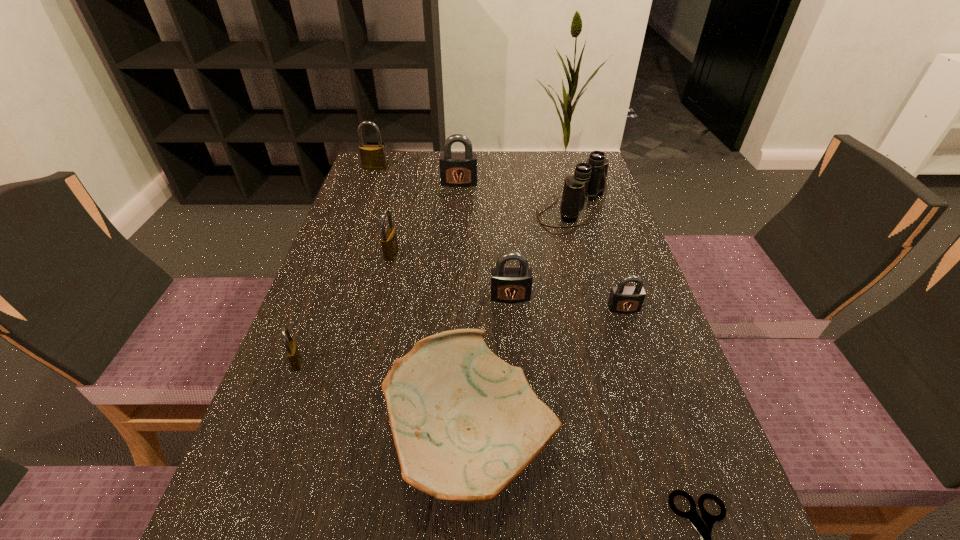
The width and height of the screenshot is (960, 540). In order to click on the nearest padlock in this screenshot , I will do `click(292, 351)`.

Image resolution: width=960 pixels, height=540 pixels. I want to click on the nearest brass padlock, so click(292, 351).

You are a GUI agent. You are given a task and a screenshot of the screen. Output one action in this format:
    pyautogui.click(x=<x>, y=<y>)
    Task: Click on the rightmost gray padlock
    Image resolution: width=960 pixels, height=540 pixels.
    Given the screenshot: What is the action you would take?
    pyautogui.click(x=623, y=299)

Identify the location of the smallest gray padlock. The image size is (960, 540). (623, 299).

Image resolution: width=960 pixels, height=540 pixels. In order to click on free location located on the right of the farthest object in this screenshot , I will do tap(474, 168).

Where is `free region located 0.070m on the front of the biggest gray padlock near the keyhole`? This screenshot has width=960, height=540. free region located 0.070m on the front of the biggest gray padlock near the keyhole is located at coordinates (458, 201).

Where is `vacant space located on the left of the binoculars`? The image size is (960, 540). vacant space located on the left of the binoculars is located at coordinates (464, 211).

Image resolution: width=960 pixels, height=540 pixels. Find the location of `vacant space located on the right of the second smallest brass padlock`. vacant space located on the right of the second smallest brass padlock is located at coordinates (561, 254).

You are a GUI agent. You are given a task and a screenshot of the screen. Output one action in this format:
    pyautogui.click(x=<x>, y=<y>)
    Task: Click on the vacant space located on the front of the second biggest gray padlock near the keyhole
    Image resolution: width=960 pixels, height=540 pixels.
    Given the screenshot: What is the action you would take?
    pyautogui.click(x=515, y=357)

Where is `vacant region located 0.110m on the left of the pottery`? vacant region located 0.110m on the left of the pottery is located at coordinates (318, 438).